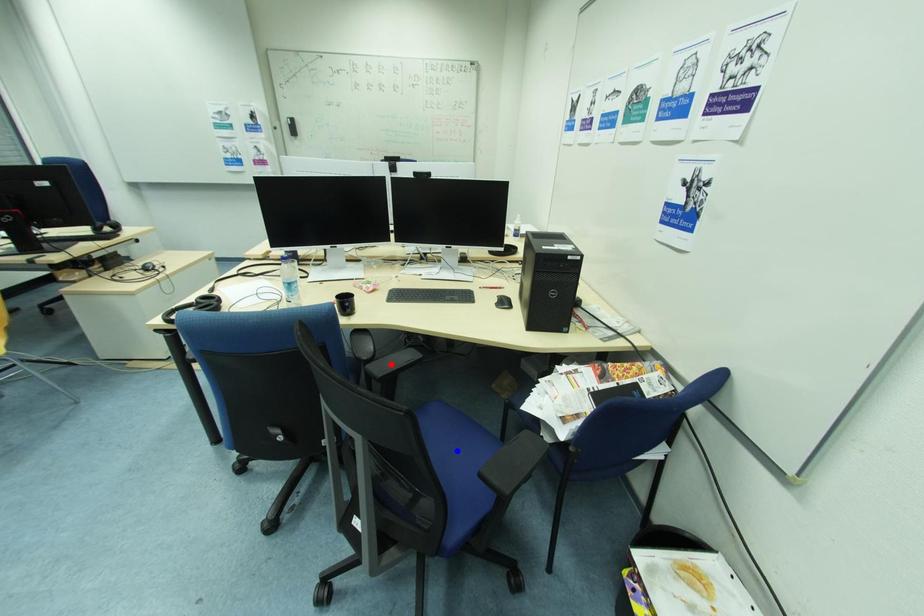
Question: Which of the two points in the image is closer to the camera?

Choices:
 (A) Blue point is closer.
 (B) Red point is closer.

Answer: (A)